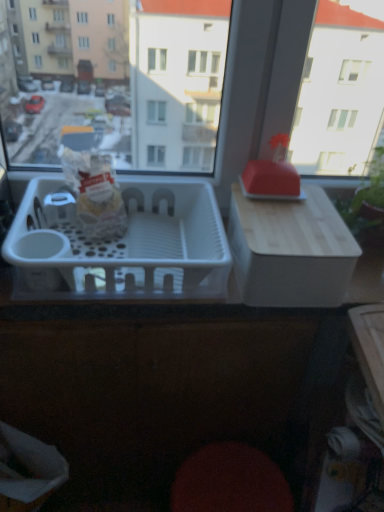
Question: Does point (372, 181) appear closer or farther from the camera than point (97, 215)?

Choices:
 (A) closer
 (B) farther

Answer: (B)

Question: In the image, is green leafy plant at upper right positioned in front of or behind matte white bag at center?

Choices:
 (A) behind
 (B) front

Answer: (A)

Question: Estimate the real-world distances between objects in this image. Which object is farther from the matte white bag at center?

Choices:
 (A) white plastic container at right
 (B) white plastic basket at center
 (C) green leafy plant at upper right

Answer: (C)

Question: Estimate the real-world distances between objects in this image. Which object is closer to the matte white bag at center?

Choices:
 (A) white plastic container at right
 (B) green leafy plant at upper right
 (C) white plastic basket at center

Answer: (C)